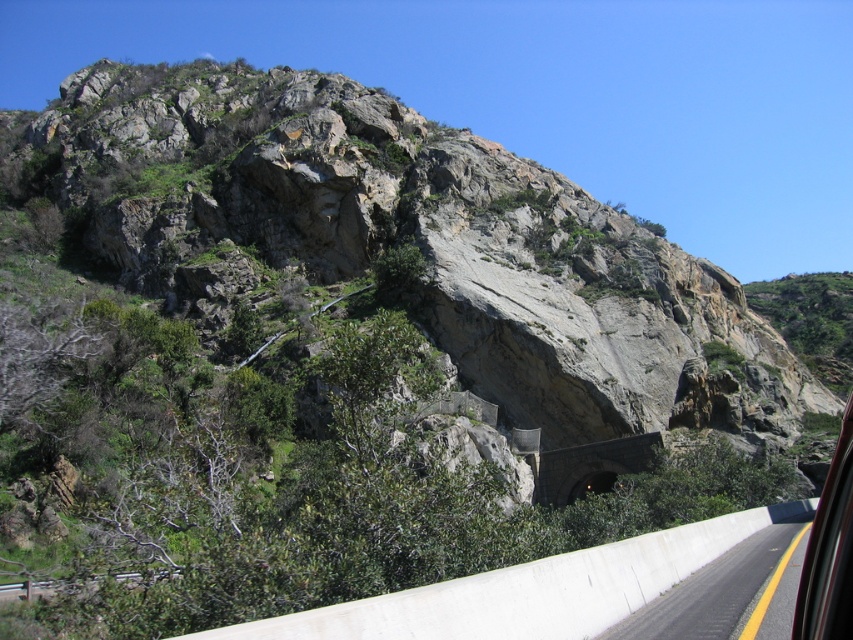
You are standing on the paved road and looking towards the rocky landscape. There are two points marked on your map at coordinates point (645, 612) and point (808, 621). Which point is closer to you?

Point (645, 612) is closer to you because it is further to the viewer than point (808, 621).

You are a driver looking at the white concrete barrier at lower right and the transparent glass car window at right. Which object is shorter in height?

The white concrete barrier at lower right is shorter in height compared to the transparent glass car window at right.